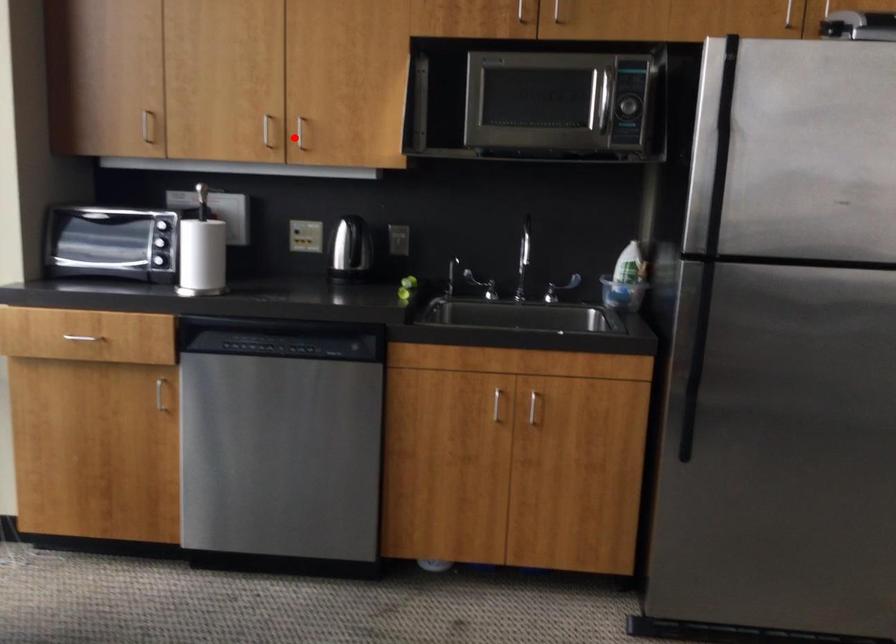
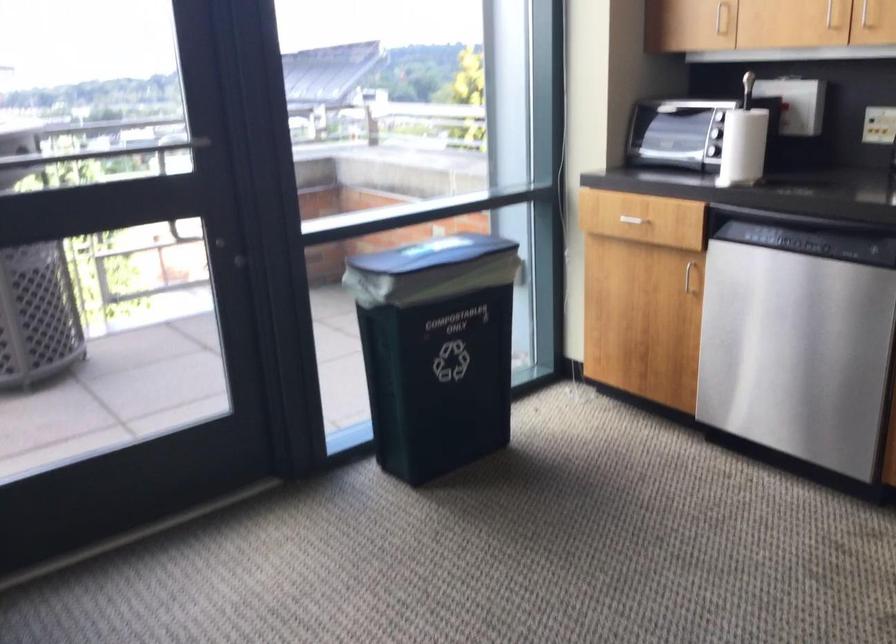
Find the pixel in the second image that matches the highlighted location in the first image.

(865, 15)